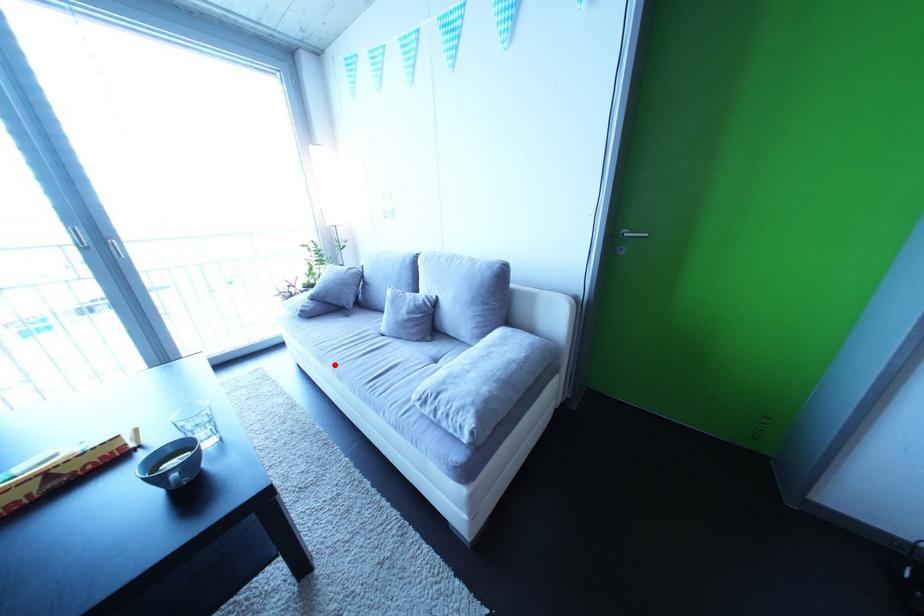
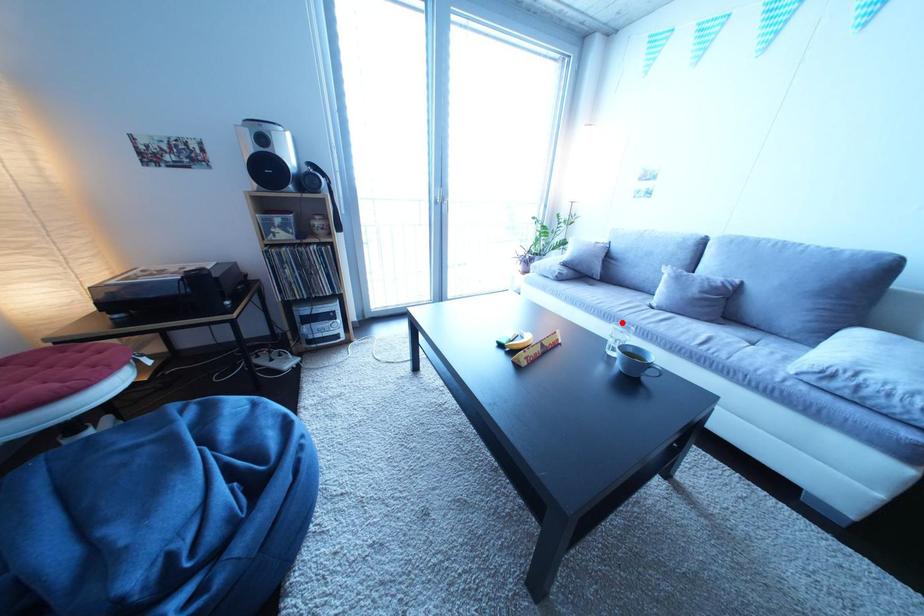
I am providing you with two images of the same scene from different viewpoints. A red point is marked on the first image and another point is marked on the second image. Is the red point in image1 aligned with the point shown in image2?

Yes